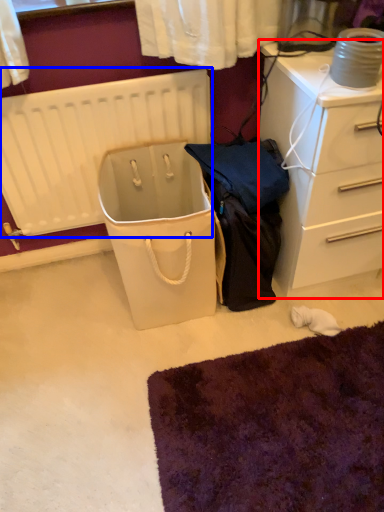
Question: Which point is closer to the camera, chest of drawers (highlighted by a red box) or radiator (highlighted by a blue box)?

Choices:
 (A) chest of drawers
 (B) radiator

Answer: (A)